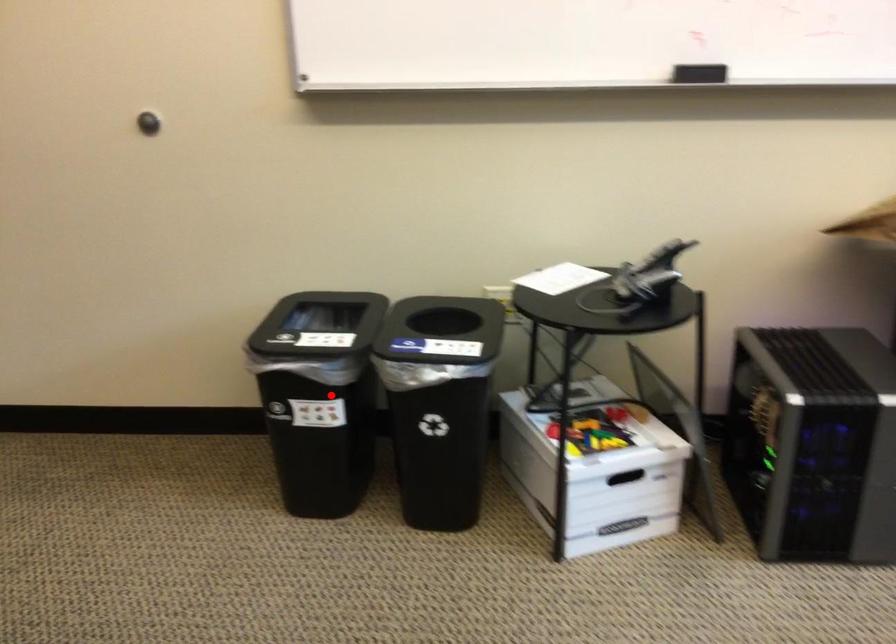
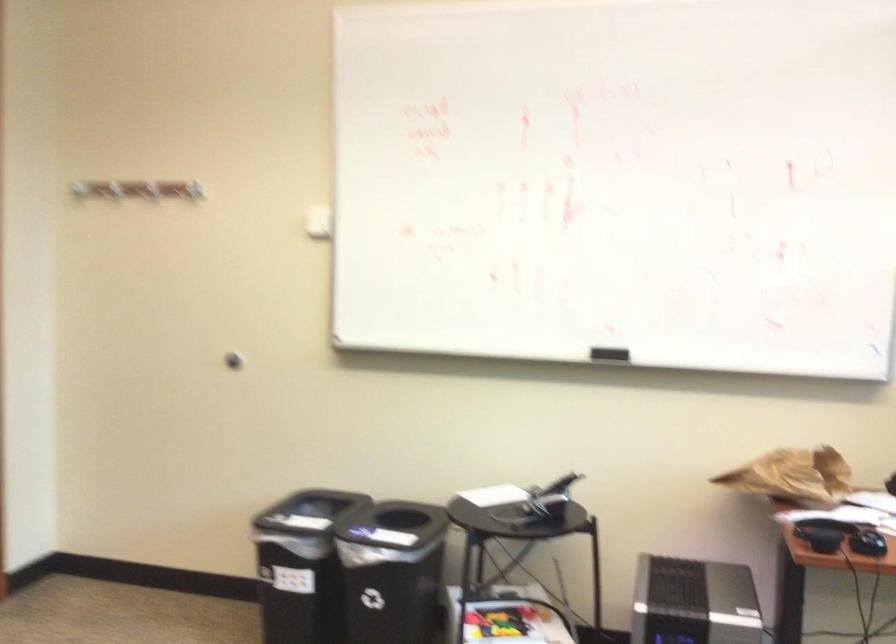
Question: I am providing you with two images of the same scene from different viewpoints. Image1 has a red point marked. In image2, the corresponding 3D location appears at what relative position? Reply with the corresponding letter.

Choices:
 (A) Closer
 (B) Farther

Answer: (B)